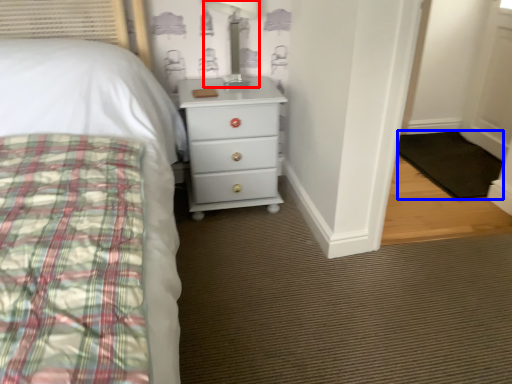
Question: Which of the following is the closest to the observer, table lamp (highlighted by a red box) or mat (highlighted by a blue box)?

Choices:
 (A) table lamp
 (B) mat

Answer: (A)